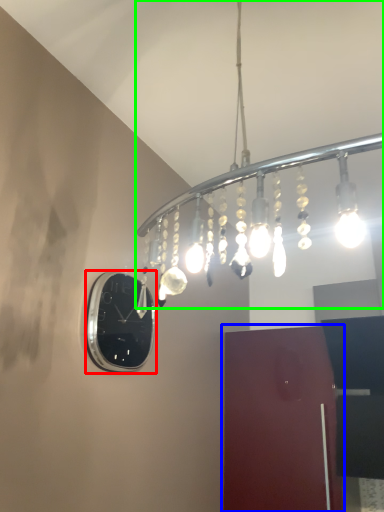
Question: Considering the real-world distances, which object is farthest from clock (highlighted by a red box)? door (highlighted by a blue box) or lamp (highlighted by a green box)?

Choices:
 (A) door
 (B) lamp

Answer: (A)